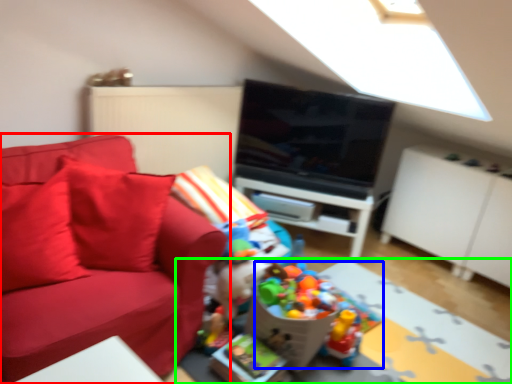
Question: Based on their relative distances, which object is nearer to studio couch (highlighted by a red box)? Choose from toy (highlighted by a blue box) and table (highlighted by a green box).

Choices:
 (A) toy
 (B) table

Answer: (A)